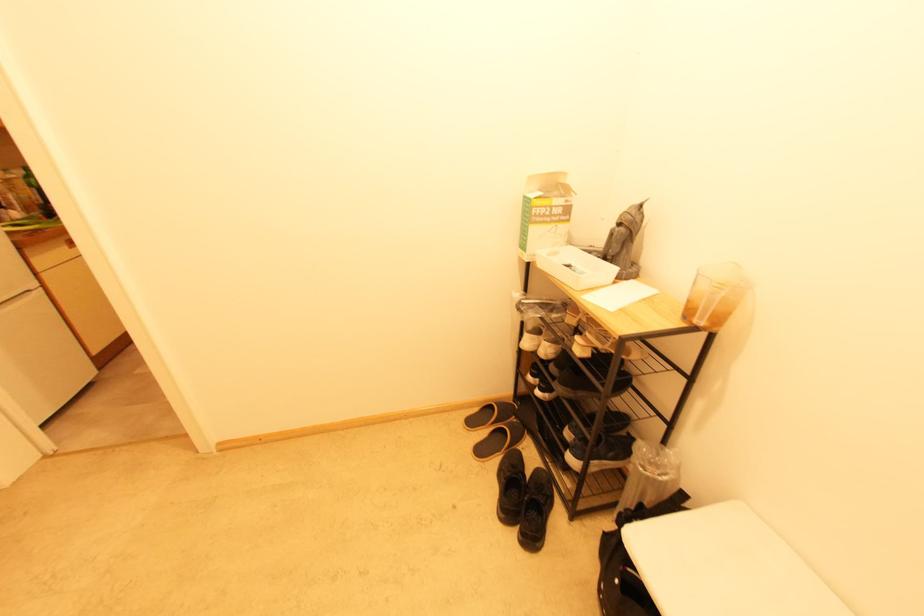
Where would you lift the black sneaker? Please return your answer as a coordinate pair (x, y).

(550, 548)